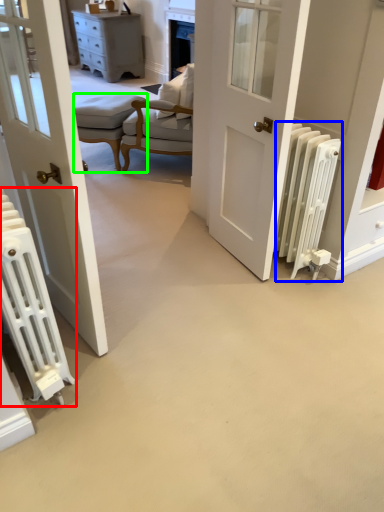
Question: Based on their relative distances, which object is farther from radiator (highlighted by a red box)? Choose from radiator (highlighted by a blue box) and stool (highlighted by a green box).

Choices:
 (A) radiator
 (B) stool

Answer: (B)